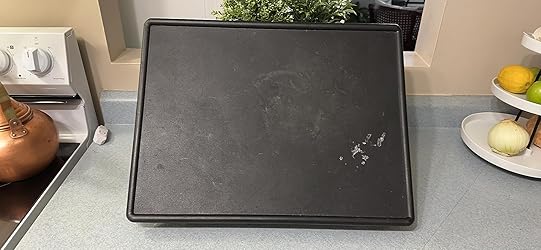
Locate an element on the screen. Image resolution: width=541 pixels, height=250 pixels. oven is located at coordinates (72, 69).